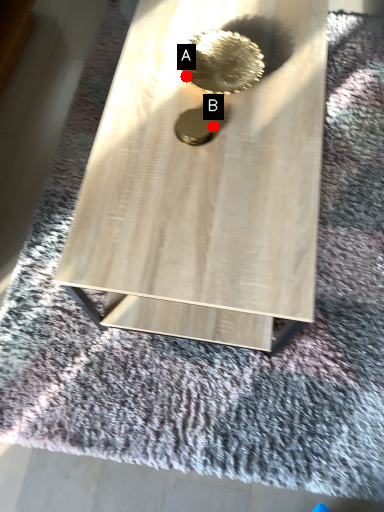
Question: Two points are circled on the image, labeled by A and B beside each circle. Among these points, which one is farthest from the camera?

Choices:
 (A) A is further
 (B) B is further

Answer: (B)